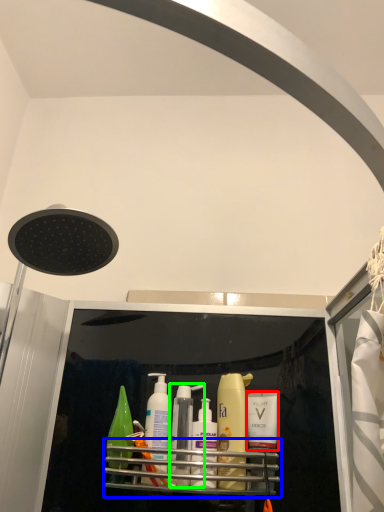
Question: Considering the real-world distances, which object is closest to toiletry (highlighted by a red box)? shelf (highlighted by a blue box) or toiletry (highlighted by a green box).

Choices:
 (A) shelf
 (B) toiletry

Answer: (A)